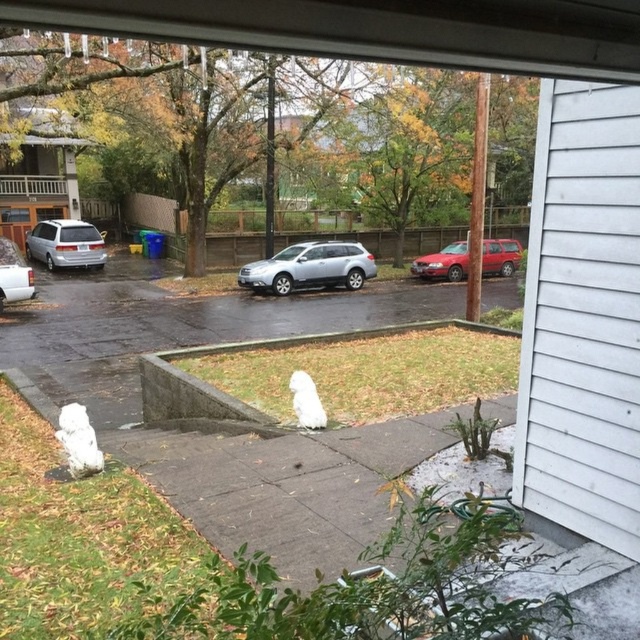
You are standing inside the house looking out the window. You see the matte silver minivan at left. Can you determine if the minivan is parked closer to the window or further away from it based on its position?

The matte silver minivan at left is located at point (65, 244), which indicates it is closer to the window since lower y coordinates are closer to the viewer.

You are standing inside the house looking out the window. You need to find the matte red station wagon at center. Based on its 2D coordinates, where should you look relative to the window view?

The matte red station wagon at center is located at the 2D coordinates point [444,262], which means it is positioned slightly to the right and lower middle of the window view.

You are a delivery person trying to park your 2.5m wide truck between the white fluffy cloud at center and the silver metallic suv at left. Can you fit your truck there?

The white fluffy cloud at center is below the silver metallic suv at left, so there is no space between them for the truck to park.